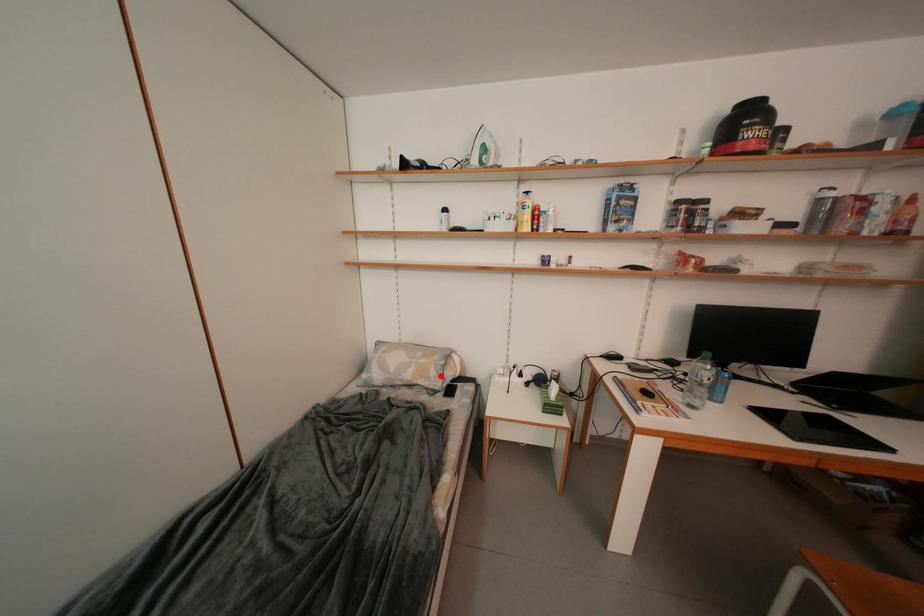
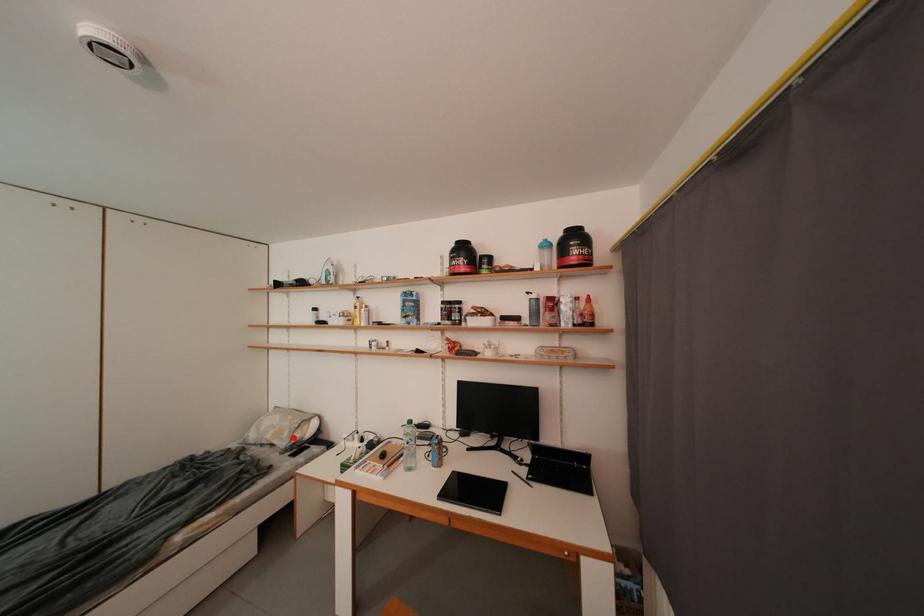
I am providing you with two images of the same scene from different viewpoints. A red point is marked on the first image and another point is marked on the second image. Are the points marked in image1 and image2 representing the same 3D position?

Yes